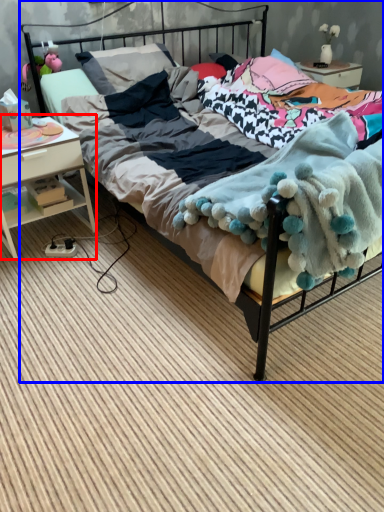
Question: Which object appears closest to the camera in this image, nightstand (highlighted by a red box) or bed (highlighted by a blue box)?

Choices:
 (A) nightstand
 (B) bed

Answer: (B)